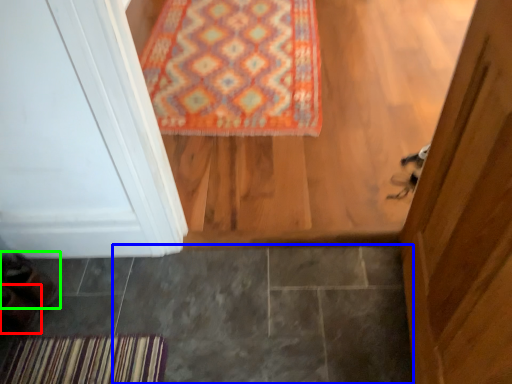
Question: Which is nearer to the shoe (highlighted by a red box)? tile (highlighted by a blue box) or shoe (highlighted by a green box).

Choices:
 (A) tile
 (B) shoe

Answer: (B)